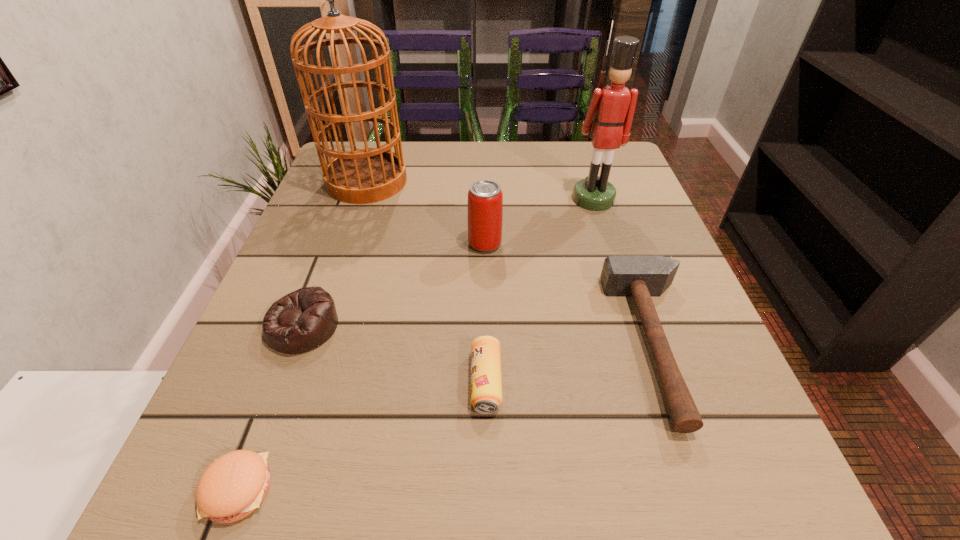
Locate an element on the screen. This screenshot has height=540, width=960. birdcage is located at coordinates (366, 175).

Where is `nutcracker`? Image resolution: width=960 pixels, height=540 pixels. nutcracker is located at coordinates (609, 117).

Locate an element on the screen. The image size is (960, 540). the fifth nearest object is located at coordinates (485, 198).

The width and height of the screenshot is (960, 540). I want to click on the third tallest object, so click(x=485, y=198).

I want to click on beanbag, so click(x=303, y=320).

Where is `hammer`? The width and height of the screenshot is (960, 540). hammer is located at coordinates (641, 277).

Locate an element on the screen. the shorter beer can is located at coordinates (486, 382).

Where is `patty`? Image resolution: width=960 pixels, height=540 pixels. patty is located at coordinates (234, 485).

You are a GUI agent. You are given a task and a screenshot of the screen. Output one action in this format:
    pyautogui.click(x=<x>, y=<y>)
    Task: Click on the free space located 0.250m on the right of the tallest object
    The image size is (960, 540).
    Given the screenshot: What is the action you would take?
    pyautogui.click(x=512, y=181)

Where is `vacant space located on the front-facing side of the nutcracker`? vacant space located on the front-facing side of the nutcracker is located at coordinates (640, 343).